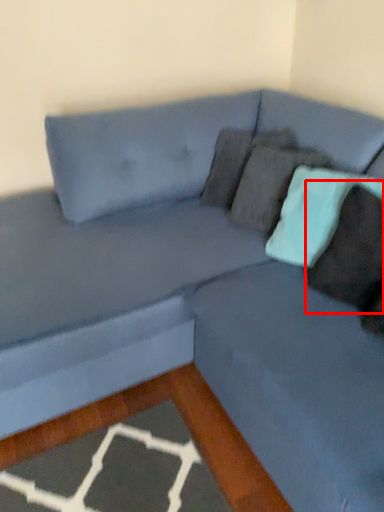
Question: Observing the image, what is the correct spatial positioning of pillow (annotated by the red box) in reference to pillow?

Choices:
 (A) right
 (B) left

Answer: (A)